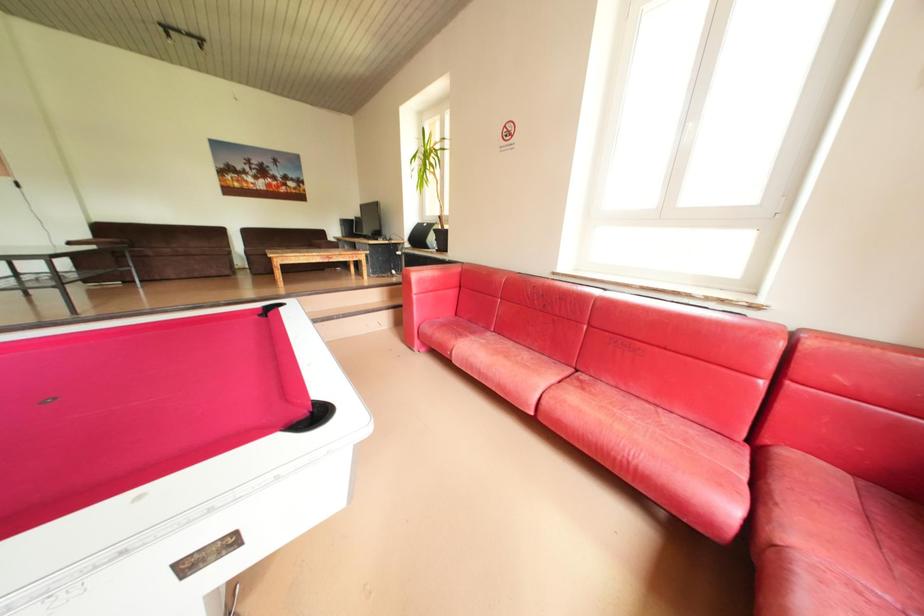
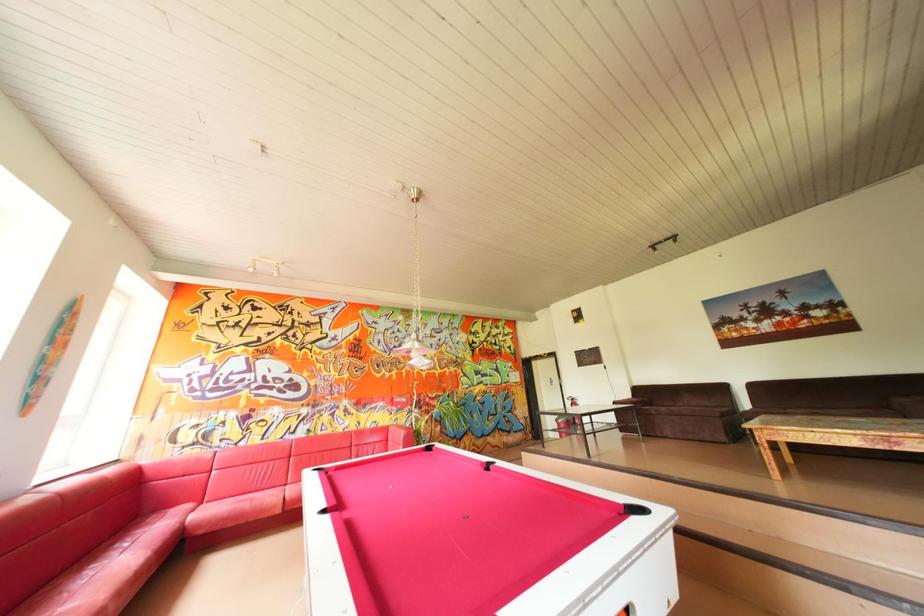
Looking at this image, the images are taken continuously from a first-person perspective. In which direction is your viewpoint rotating?

The camera's rotation is toward left-up.